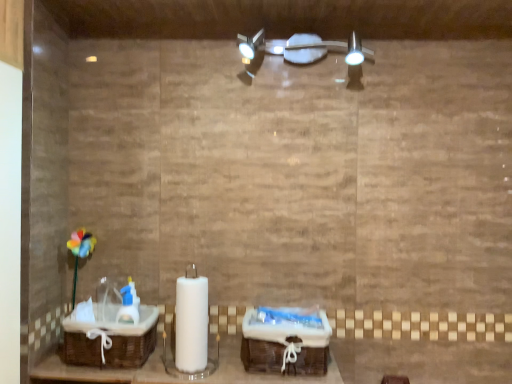
Identify the location of vacant area on top of brown woven basket at lower left (from a real-world perspective). (120, 320).